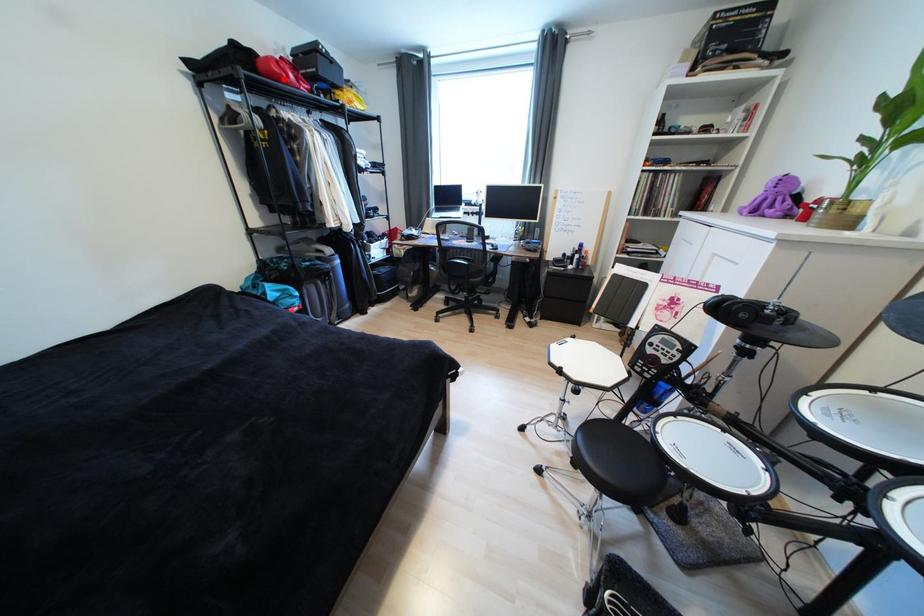
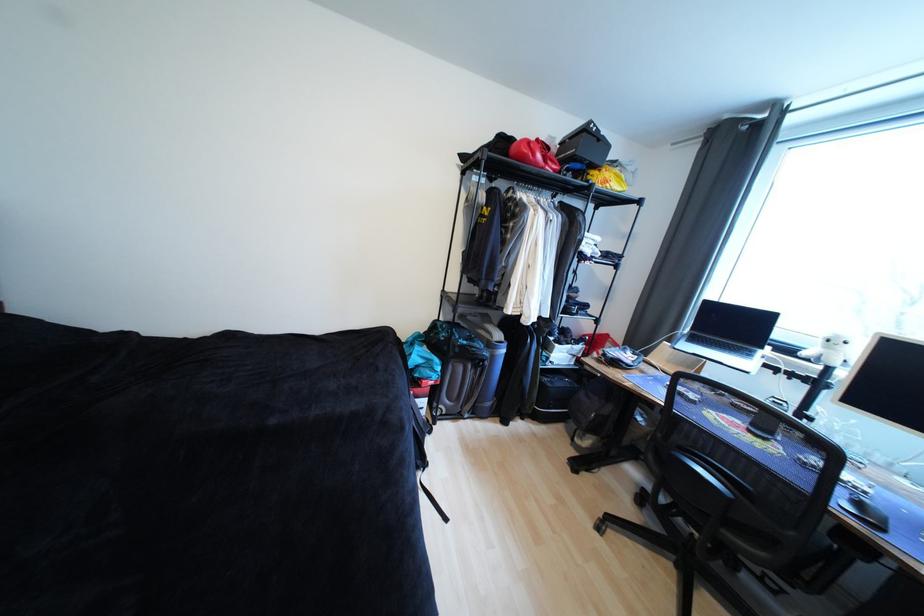
Locate, in the second image, the point that corresponds to the highlighted location in the first image.

(529, 159)